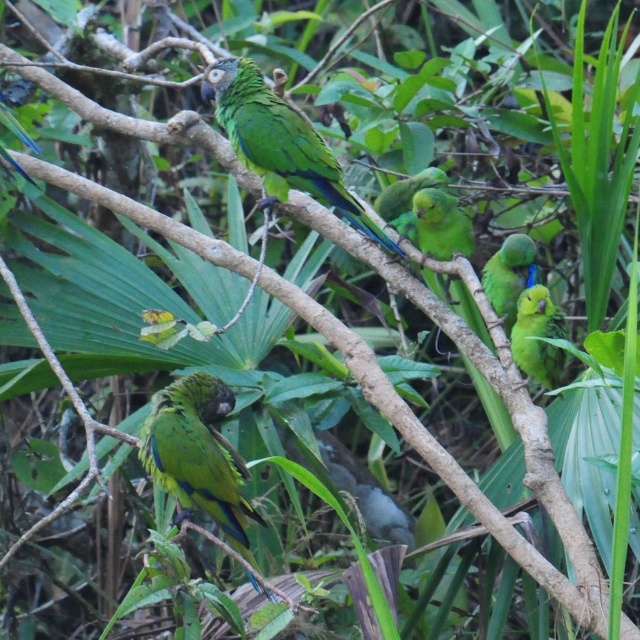
Measure the distance between green matte parrot at upper right and green glossy parrot at center.

They are 12.32 inches apart.

Does green matte parrot at upper right come in front of green glossy parrot at center?

Yes, it is in front of green glossy parrot at center.

Does point (506, 282) come closer to viewer compared to point (396, 212)?

Yes.

At what (x,y) coordinates should I click in order to perform the action: click on green matte parrot at upper right. Please return your answer as a coordinate pair (x, y). Looking at the image, I should click on (509, 275).

How far apart are green matte parrot at lower left and green matte parrot at upper center?

The distance of green matte parrot at lower left from green matte parrot at upper center is 61.98 centimeters.

Is green matte parrot at lower left thinner than green matte parrot at upper center?

Yes.

This screenshot has width=640, height=640. I want to click on green matte parrot at lower left, so click(196, 456).

Is green matte parrot at right bigger than green matte parrot at center?

Correct, green matte parrot at right is larger in size than green matte parrot at center.

Is green matte parrot at right wider than green matte parrot at center?

Incorrect, green matte parrot at right's width does not surpass green matte parrot at center's.

Who is more forward, (528, 314) or (468, 243)?

Positioned in front is point (528, 314).

Identify the location of green matte parrot at right. Image resolution: width=640 pixels, height=640 pixels. (538, 337).